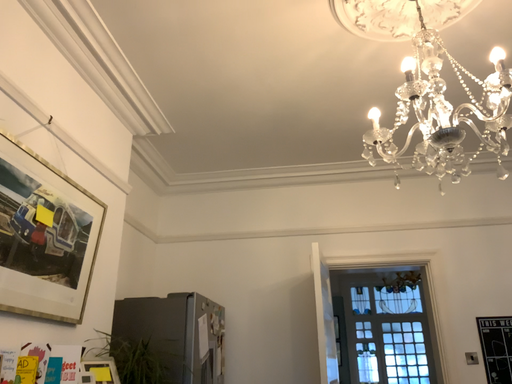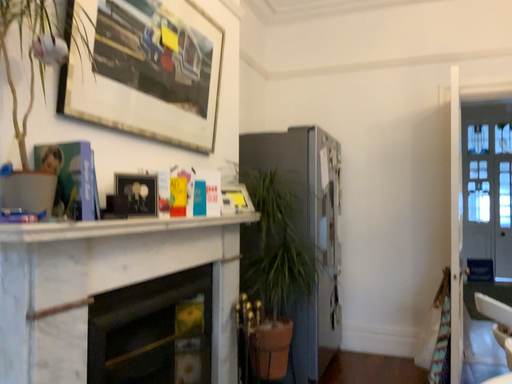
Question: Which way did the camera rotate in the video?

Choices:
 (A) rotated right
 (B) rotated left

Answer: (B)